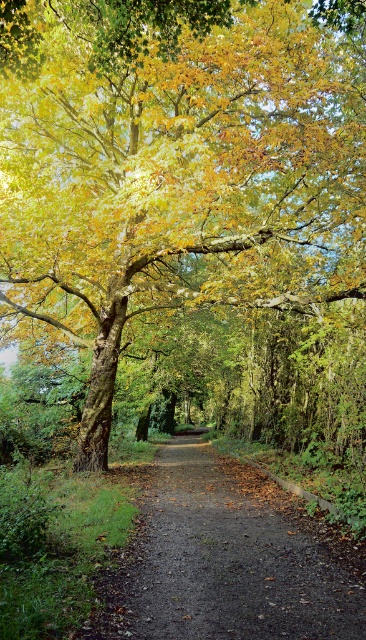
You are a hiker walking along the dirt path at center and want to take a photo of the golden leafy tree at center. Since the tree is above the path, where should you position yourself to capture the entire tree in your camera frame?

The golden leafy tree at center is located above the dirt path at center, so you should position yourself on the dirt path at center and look upward to capture the entire tree in your camera frame.

You are a hiker who wants to take a photo of the golden leafy tree at center and the dirt path at center. Which object should you focus on if you want to capture the height difference between them?

The golden leafy tree at center has a greater height compared to the dirt path at center, so you should focus on the golden leafy tree at center to emphasize its height difference with the dirt path at center.

You are a hiker carrying a large backpack and want to walk along the dirt path at center. However, you notice a golden leafy tree at center blocking your way. Can you pass through the area between them?

The golden leafy tree at center is bigger than the dirt path at center, so the tree might be obstructing the path. It is uncertain if there is enough space to pass through safely.